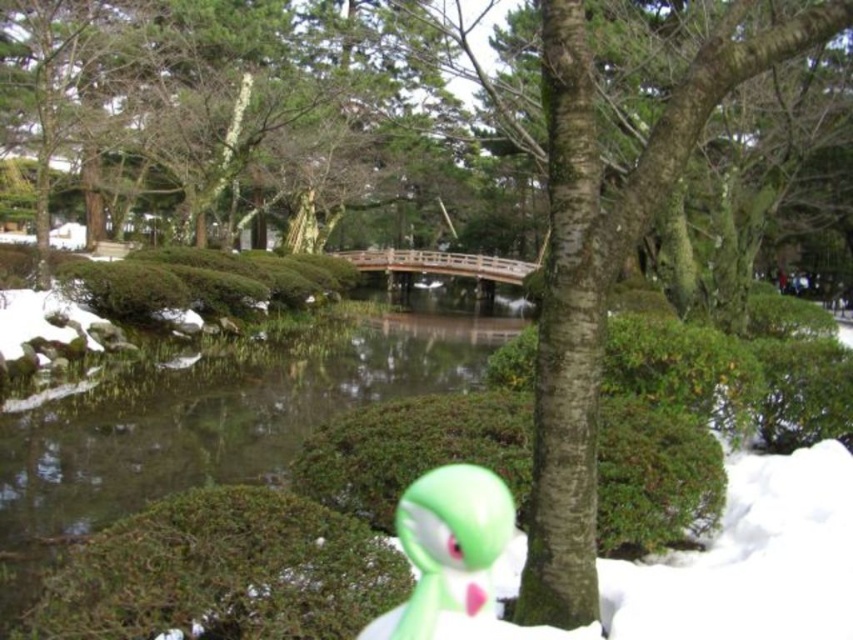
Question: Observing the image, what is the correct spatial positioning of clear water at center in reference to green matte toy at center?

Choices:
 (A) left
 (B) right

Answer: (A)

Question: Can you confirm if clear water at center is positioned above green matte toy at center?

Choices:
 (A) no
 (B) yes

Answer: (A)

Question: Which of the following is the closest to the observer?

Choices:
 (A) (512, 627)
 (B) (141, 458)

Answer: (A)

Question: In this image, where is clear water at center located relative to green matte toy at center?

Choices:
 (A) below
 (B) above

Answer: (A)